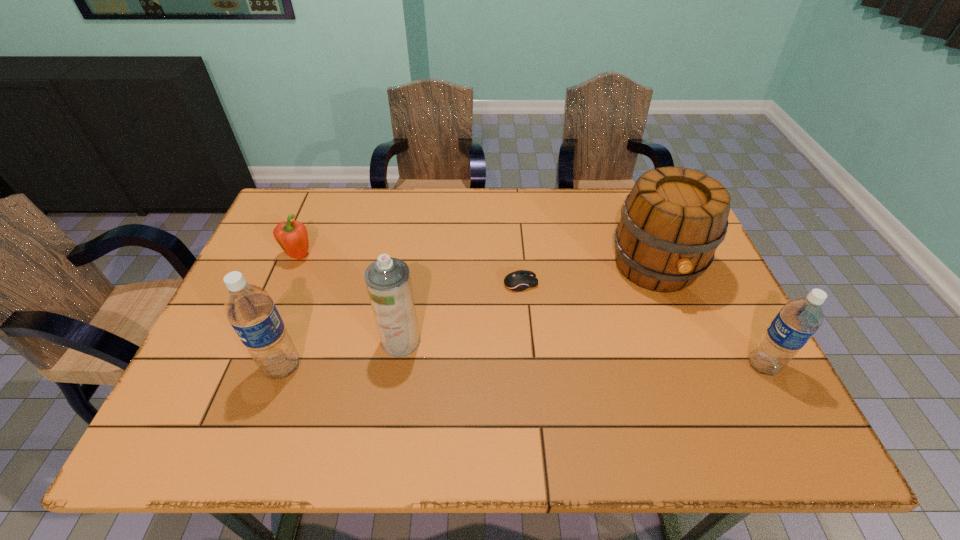
You are a GUI agent. You are given a task and a screenshot of the screen. Output one action in this format:
    pyautogui.click(x=<x>, y=<y>)
    Task: Click on the vacant space located 0.190m on the back of the computer mouse
    The width and height of the screenshot is (960, 540).
    Given the screenshot: What is the action you would take?
    pyautogui.click(x=516, y=231)

You are a GUI agent. You are given a task and a screenshot of the screen. Output one action in this format:
    pyautogui.click(x=<x>, y=<y>)
    Task: Click on the free space located on the side of the cider where the spigot is located
    The width and height of the screenshot is (960, 540).
    Given the screenshot: What is the action you would take?
    pyautogui.click(x=696, y=369)

Where is `free space located on the back of the fourth object from right to left`? The image size is (960, 540). free space located on the back of the fourth object from right to left is located at coordinates (410, 285).

At what (x,y) coordinates should I click in order to perform the action: click on object that is positioned at the far edge. Please return your answer as a coordinate pair (x, y). The width and height of the screenshot is (960, 540). Looking at the image, I should click on (673, 220).

The width and height of the screenshot is (960, 540). In order to click on water bottle located in the left edge section of the desktop in this screenshot , I will do `click(250, 310)`.

Identify the location of pepper situated at the left edge. (292, 237).

This screenshot has height=540, width=960. In order to click on water bottle positioned at the right edge in this screenshot , I will do `click(799, 319)`.

Locate an element on the screen. This screenshot has height=540, width=960. cider located in the right edge section of the desktop is located at coordinates (673, 220).

This screenshot has height=540, width=960. Find the location of `object that is at the near left corner`. object that is at the near left corner is located at coordinates (250, 310).

Image resolution: width=960 pixels, height=540 pixels. I want to click on object present at the far right corner, so click(x=673, y=220).